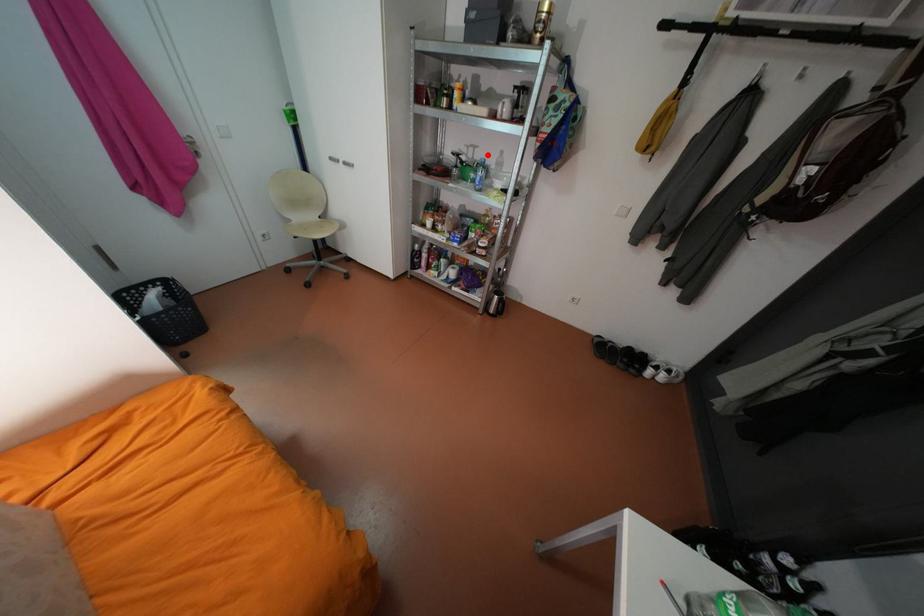
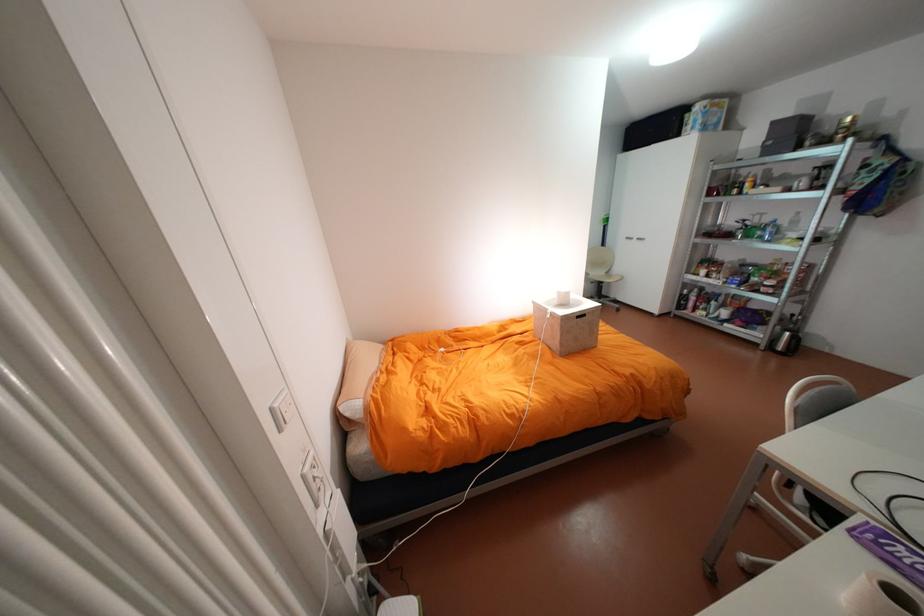
Question: I am providing you with two images of the same scene from different viewpoints. A red point is shown in image1. For the corresponding object point in image2, is it positioned nearer or farther from the camera?

Choices:
 (A) Nearer
 (B) Farther

Answer: (B)